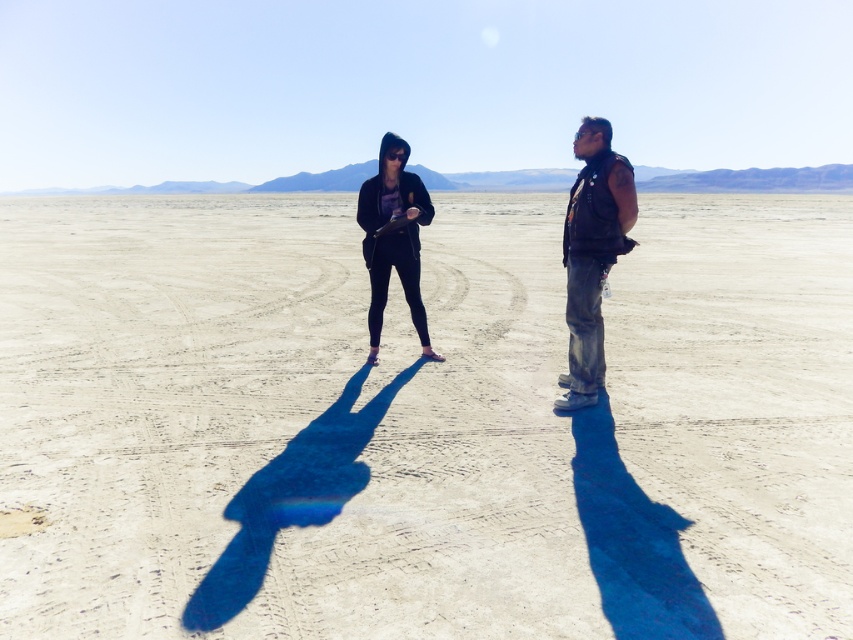
Is black leather vest at right smaller than matte black hoodie at center?

Correct, black leather vest at right occupies less space than matte black hoodie at center.

Is point (572, 403) closer to camera compared to point (397, 234)?

Yes, it is in front of point (397, 234).

I want to click on black leather vest at right, so click(x=592, y=253).

Does smooth sand at center appear on the left side of black leather vest at right?

Correct, you'll find smooth sand at center to the left of black leather vest at right.

Between point (715, 250) and point (585, 172), which one is positioned in front?

Point (585, 172)

Find the location of a particular element. This screenshot has width=853, height=640. smooth sand at center is located at coordinates (422, 422).

Does smooth sand at center lie behind matte black hoodie at center?

No, smooth sand at center is closer to the viewer.

You are a GUI agent. You are given a task and a screenshot of the screen. Output one action in this format:
    pyautogui.click(x=<x>, y=<y>)
    Task: Click on the smooth sand at center
    The height and width of the screenshot is (640, 853).
    Given the screenshot: What is the action you would take?
    pyautogui.click(x=422, y=422)